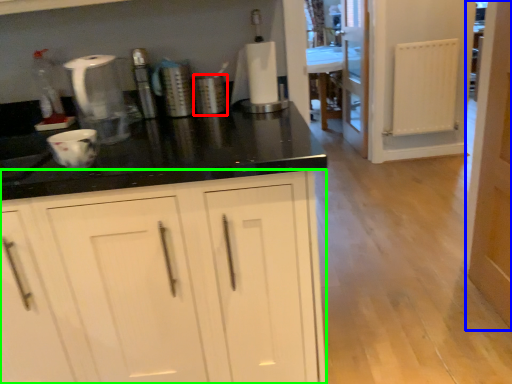
Question: Considering the real-world distances, which object is farthest from appliance (highlighted by a red box)? door (highlighted by a blue box) or cabinetry (highlighted by a green box)?

Choices:
 (A) door
 (B) cabinetry

Answer: (A)